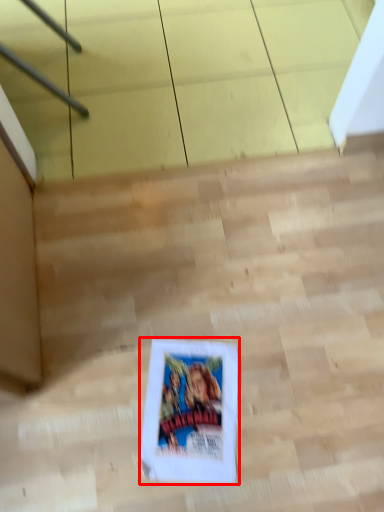
Question: From the image's perspective, considering the relative positions of comic book (annotated by the red box) and stairwell in the image provided, where is comic book (annotated by the red box) located with respect to the staircase?

Choices:
 (A) below
 (B) above

Answer: (A)